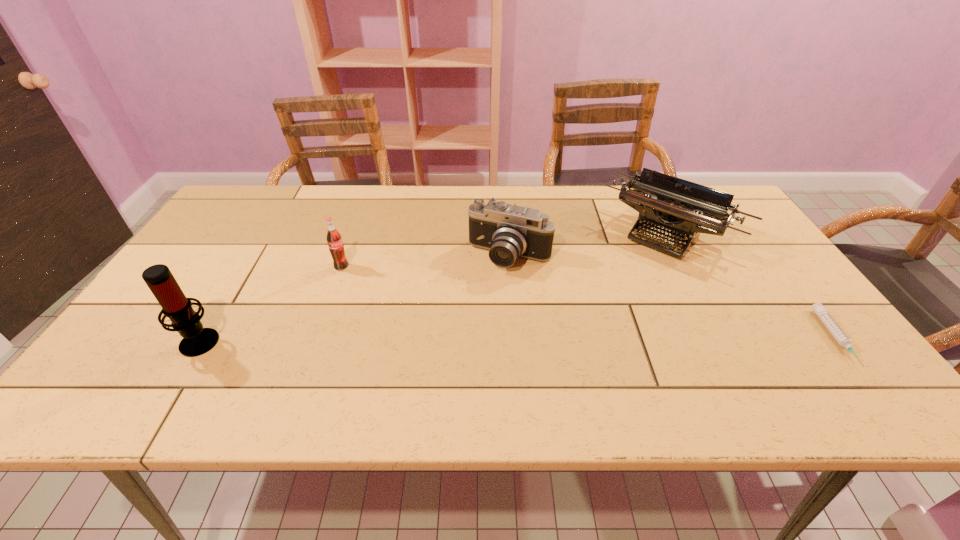
Locate an element on the screen. free space located on the label of the soda bottle is located at coordinates (419, 323).

Where is `free space located on the typing side of the typewriter`? This screenshot has height=540, width=960. free space located on the typing side of the typewriter is located at coordinates (589, 318).

You are a GUI agent. You are given a task and a screenshot of the screen. Output one action in this format:
    pyautogui.click(x=<x>, y=<y>)
    Task: Click on the vacant space situated 0.070m on the typing side of the typewriter
    
    Given the screenshot: What is the action you would take?
    pyautogui.click(x=629, y=271)

The image size is (960, 540). What are the coordinates of `blank space located on the typing side of the typewriter` in the screenshot? It's located at coord(593,313).

Image resolution: width=960 pixels, height=540 pixels. What are the coordinates of `vacant space situated on the front-facing side of the third object from right to left` in the screenshot? It's located at (452, 362).

The height and width of the screenshot is (540, 960). In order to click on free space located 0.210m on the front-facing side of the third object from right to left in this screenshot , I will do `click(468, 333)`.

At what (x,y) coordinates should I click in order to perform the action: click on vacant space situated on the front-facing side of the third object from right to left. Please return your answer as a coordinate pair (x, y). The width and height of the screenshot is (960, 540). Looking at the image, I should click on (475, 318).

Identify the location of object at the far edge. (681, 208).

Where is `microphone positioned at the near edge`? Image resolution: width=960 pixels, height=540 pixels. microphone positioned at the near edge is located at coordinates (197, 340).

The image size is (960, 540). I want to click on syringe that is at the near edge, so click(x=821, y=311).